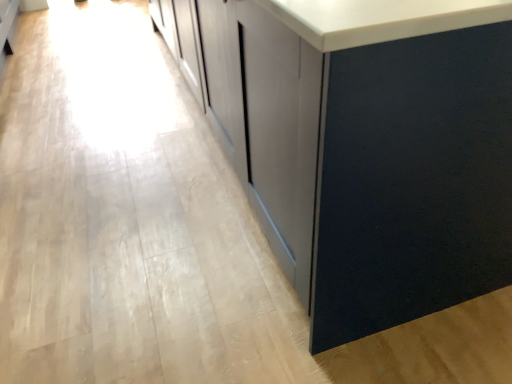
Identify the location of matte gray cabinet at center. The width and height of the screenshot is (512, 384). (362, 144).

The width and height of the screenshot is (512, 384). Describe the element at coordinates (362, 144) in the screenshot. I see `matte gray cabinet at center` at that location.

Measure the distance between matte gray cabinet at center and camera.

matte gray cabinet at center is 25.72 inches away from camera.

Image resolution: width=512 pixels, height=384 pixels. Identify the location of matte gray cabinet at center. point(362,144).